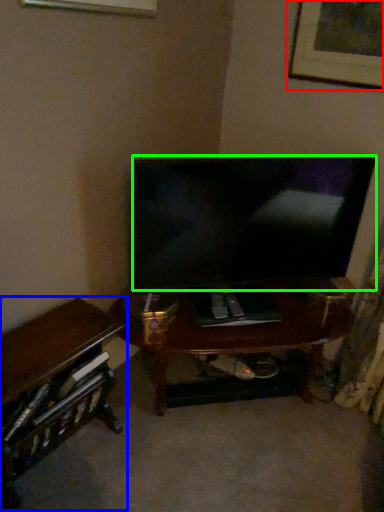
Question: Based on their relative distances, which object is farther from picture frame (highlighted by a red box)? Choose from desk (highlighted by a blue box) and television (highlighted by a green box).

Choices:
 (A) desk
 (B) television

Answer: (A)